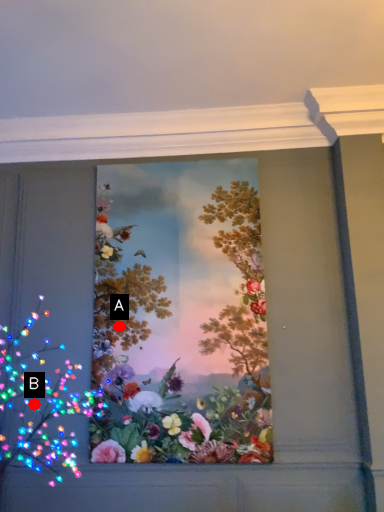
Question: Two points are circled on the image, labeled by A and B beside each circle. Which point is closer to the camera?

Choices:
 (A) A is closer
 (B) B is closer

Answer: (B)